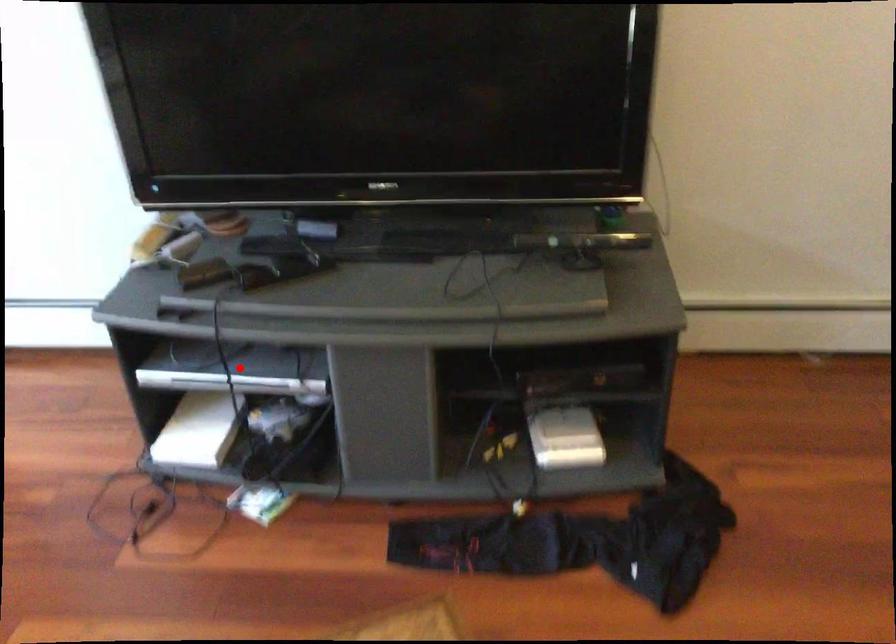
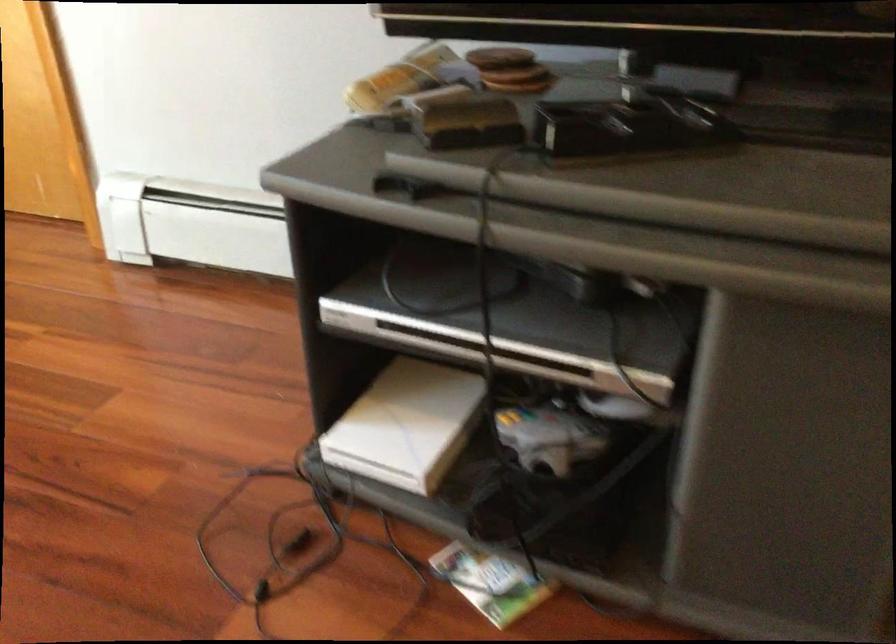
In the second image, find the point that corresponds to the highlighted location in the first image.

(505, 321)